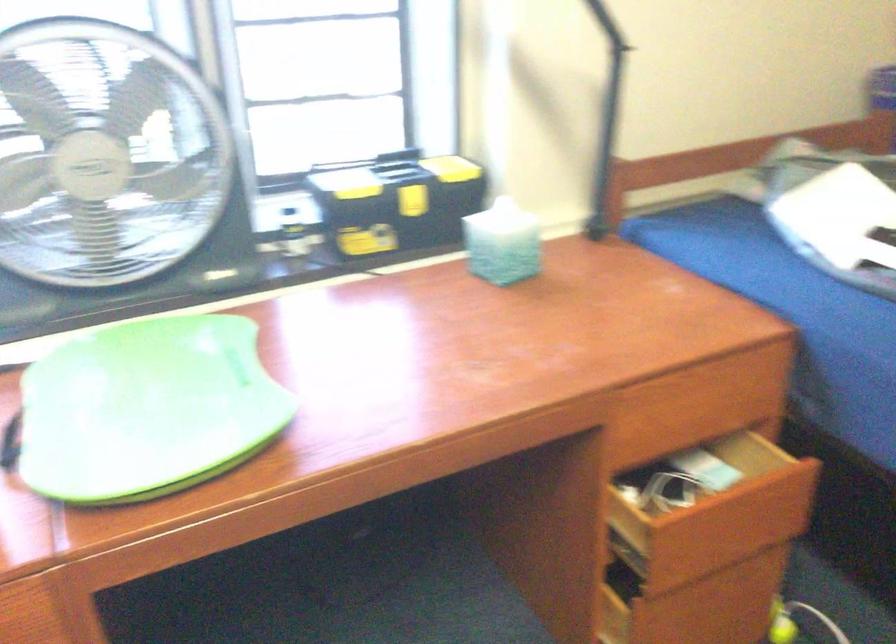
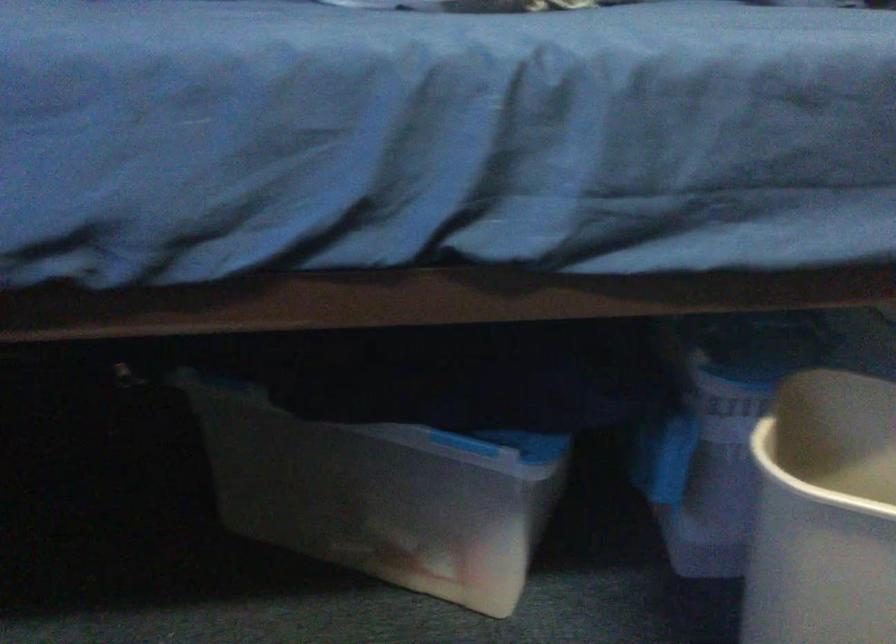
Question: How did the camera likely rotate?

Choices:
 (A) Left
 (B) Right
 (C) Up
 (D) Down

Answer: (B)